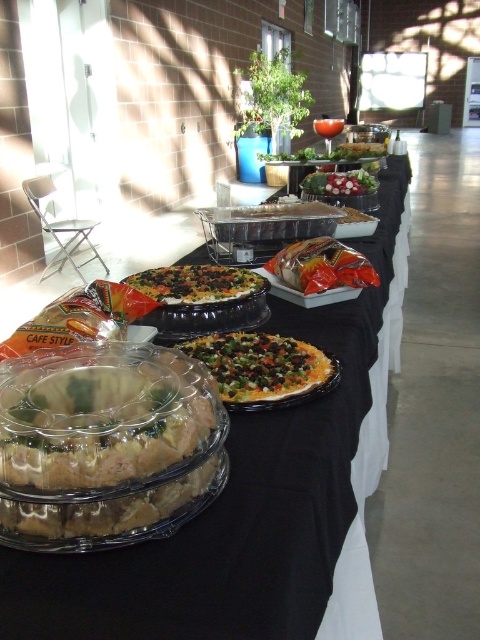
Question: Can you confirm if vegetable-topped pizza at center is positioned above translucent plastic bag at center?

Choices:
 (A) yes
 (B) no

Answer: (B)

Question: Which of the following is the farthest from the observer?

Choices:
 (A) (x=236, y=388)
 (B) (x=61, y=460)
 (C) (x=190, y=310)

Answer: (C)

Question: Does translucent plastic bag at center appear under vegetable-studded flatbread at center?

Choices:
 (A) yes
 (B) no

Answer: (B)

Question: Which of the following is the closest to the observer?

Choices:
 (A) clear plastic tray at center
 (B) fresh green salad at center

Answer: (A)

Question: Which of the following is the farthest from the observer?

Choices:
 (A) (199, 300)
 (B) (285, 625)

Answer: (A)

Question: Where is vegetable-topped pizza at center located in relation to translucent plastic bag at center in the image?

Choices:
 (A) left
 (B) right

Answer: (A)